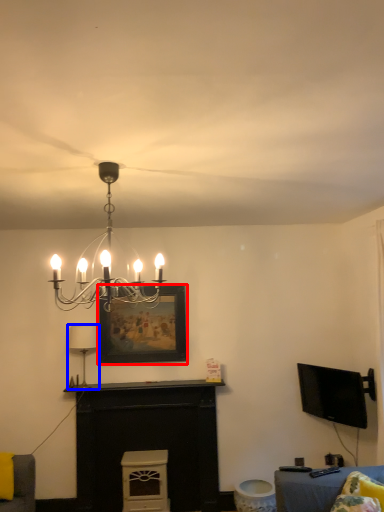
Question: Which object appears closest to the camera in this image, picture frame (highlighted by a red box) or lamp (highlighted by a blue box)?

Choices:
 (A) picture frame
 (B) lamp

Answer: (B)